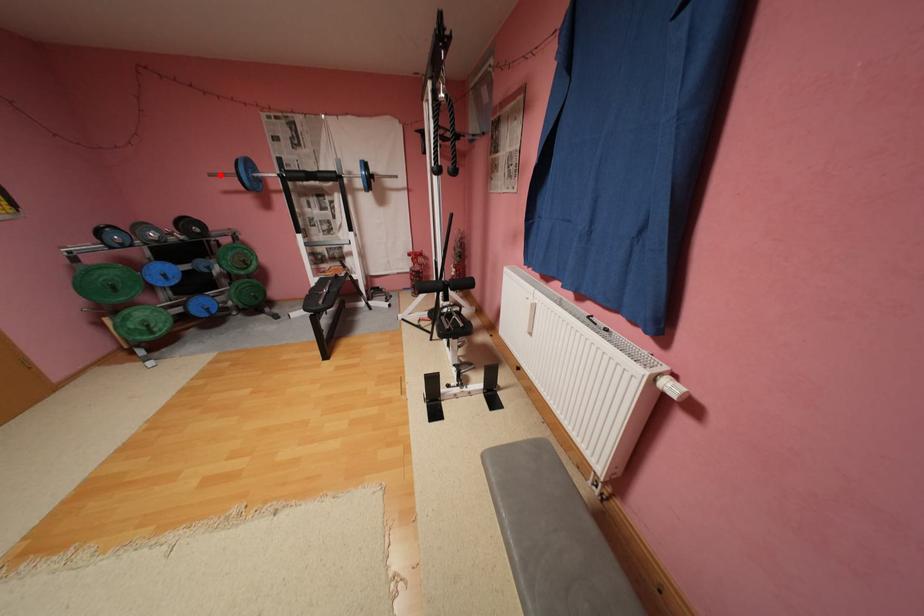
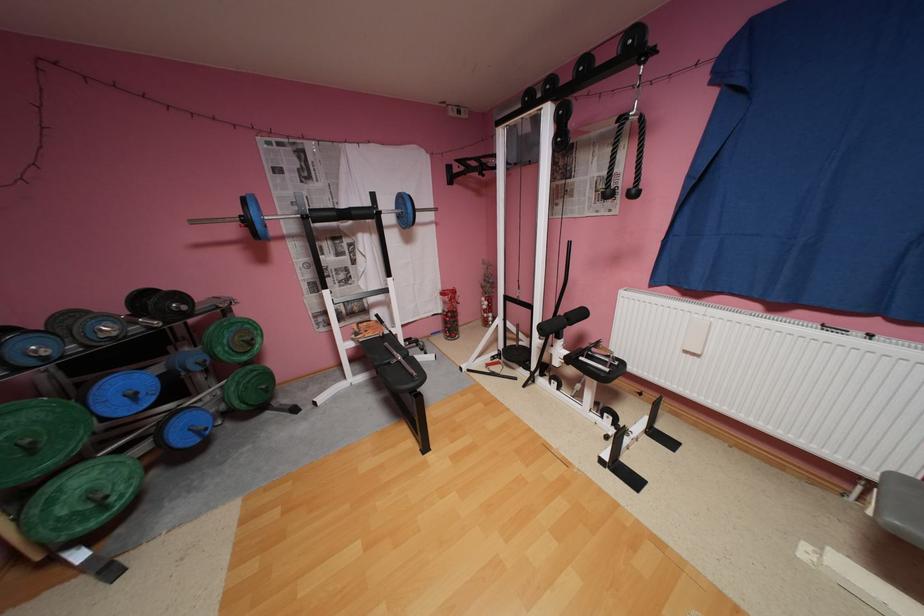
Where in the second image is the point corresponding to the highlighted location from the first image?

(202, 223)